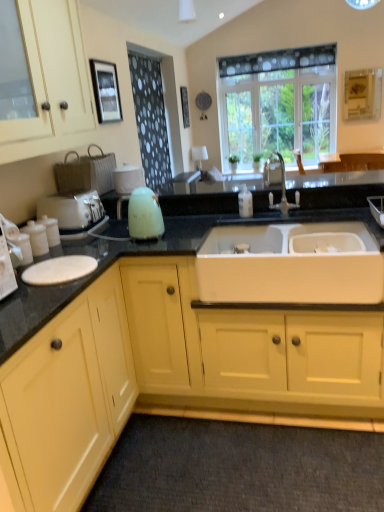
Question: Considering the positions of yellow matte cabinet at left, which is the second cabinetry in top-to-bottom order, and white matte sink at center in the image, is yellow matte cabinet at left, which is the second cabinetry in top-to-bottom order, wider or thinner than white matte sink at center?

Choices:
 (A) wide
 (B) thin

Answer: (A)

Question: Do you think yellow matte cabinet at left, which is the second cabinetry in top-to-bottom order, is within white matte sink at center, or outside of it?

Choices:
 (A) outside
 (B) inside

Answer: (A)

Question: Considering the real-world distances, which object is farthest from the matte cream cabinet at upper left, the first cabinetry in the top-to-bottom sequence?

Choices:
 (A) black dotted fabric at upper left
 (B) white matte sink at center
 (C) silver metallic faucet at upper center
 (D) white plastic toaster at left
 (E) dark gray carpet at lower center

Answer: (E)

Question: Which object is the farthest from the white matte sink at center?

Choices:
 (A) dark gray carpet at lower center
 (B) black granite countertop at center
 (C) yellow matte cabinet at left, the first cabinetry in the bottom-to-top sequence
 (D) silver metallic faucet at upper center
 (E) black dotted fabric at upper left

Answer: (E)